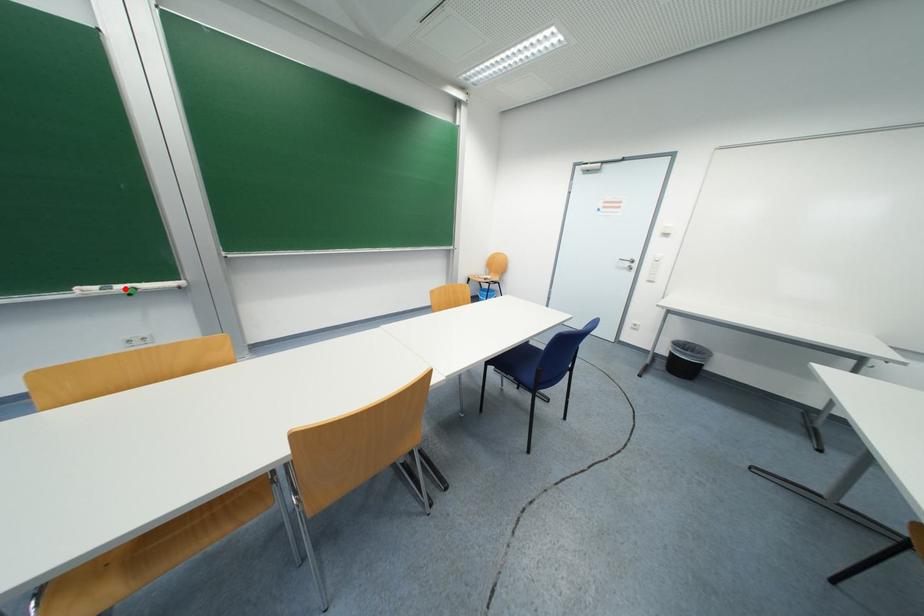
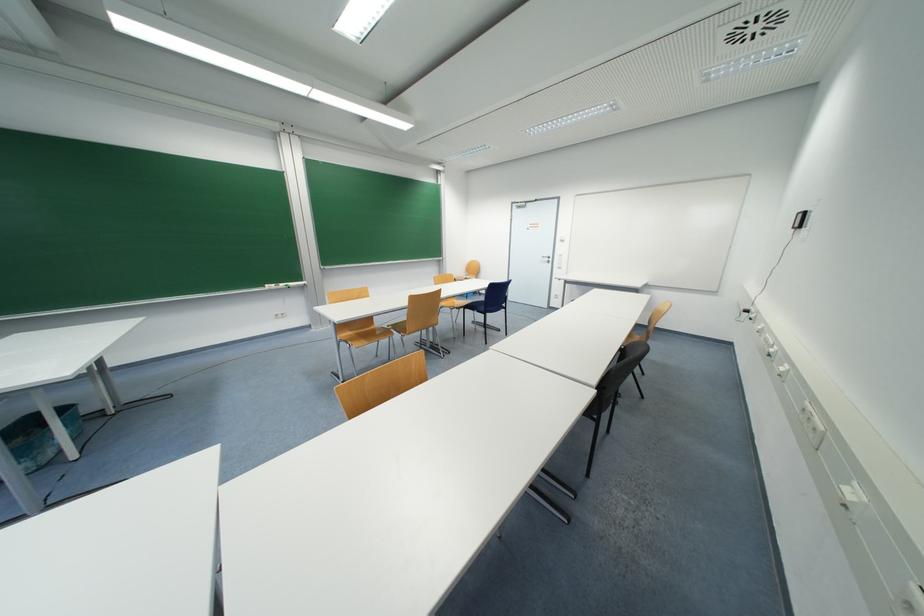
Locate, in the second image, the point that corresponds to the highlighted location in the first image.

(286, 286)